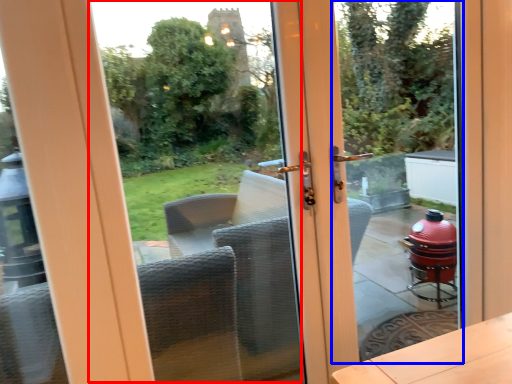
Question: Among these objects, which one is nearest to the camera, window screen (highlighted by a red box) or glass door (highlighted by a blue box)?

Choices:
 (A) window screen
 (B) glass door

Answer: (A)